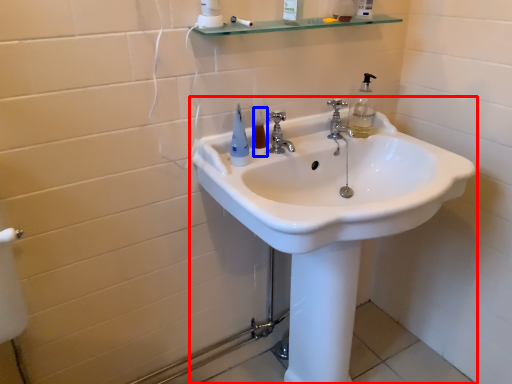
Question: Which object appears closest to the camera in this image, sink (highlighted by a red box) or mouthwash (highlighted by a blue box)?

Choices:
 (A) sink
 (B) mouthwash

Answer: (A)